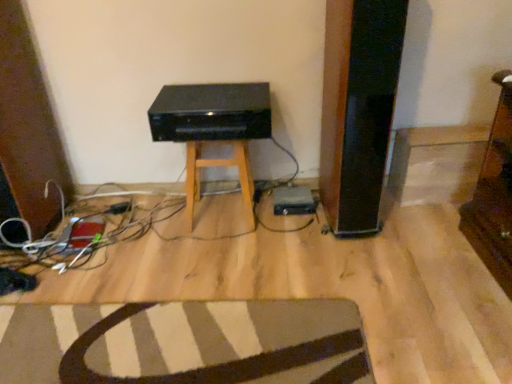
The image size is (512, 384). I want to click on vacant area situated below black matte stool at center (from a real-world perspective), so [218, 212].